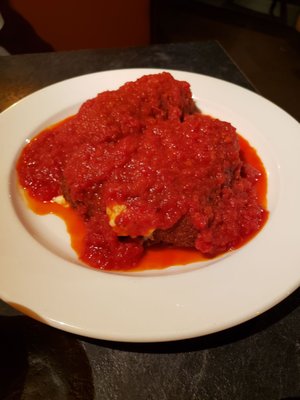
The height and width of the screenshot is (400, 300). I want to click on shadow on plate, so [28, 312].